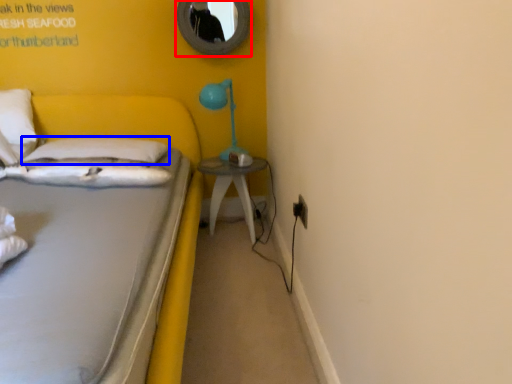
Question: Which object appears closest to the camera in this image, mirror (highlighted by a red box) or pillow (highlighted by a blue box)?

Choices:
 (A) mirror
 (B) pillow

Answer: (B)